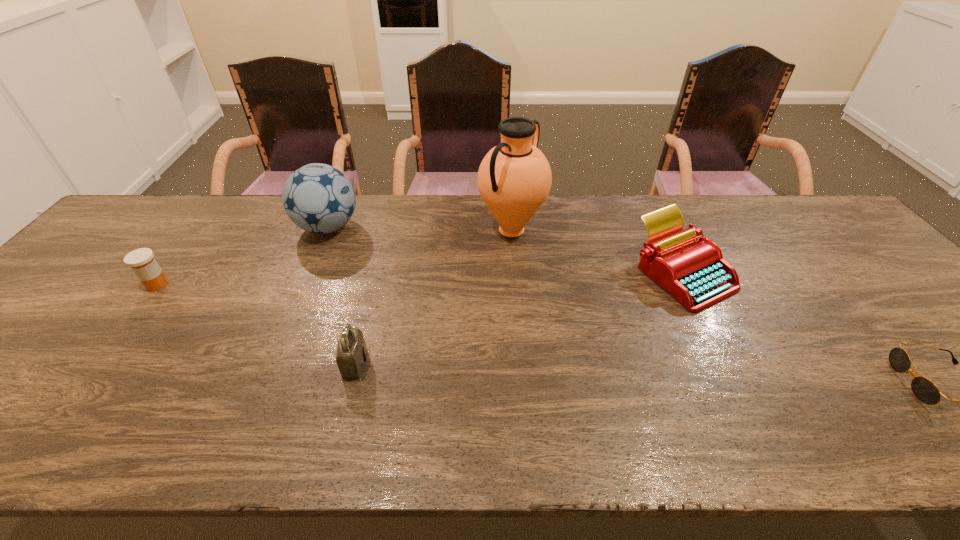
What are the coordinates of `vacant point located between the medicine and the third object from left to right` in the screenshot? It's located at coord(256,324).

Image resolution: width=960 pixels, height=540 pixels. Find the location of `empty space that is in between the second shortest object and the fifth object from right to left`. empty space that is in between the second shortest object and the fifth object from right to left is located at coordinates (243, 256).

Locate an element on the screen. vacant region between the tallest object and the fifth object from left to right is located at coordinates (597, 252).

The image size is (960, 540). In order to click on vacant area between the medicine and the padlock in this screenshot , I will do `click(256, 324)`.

Locate an element on the screen. free space between the third object from left to right and the second tallest object is located at coordinates click(342, 295).

At what (x,y) coordinates should I click in order to perform the action: click on object that ranks as the fifth closest to the rightmost object. Please return your answer as a coordinate pair (x, y). The height and width of the screenshot is (540, 960). Looking at the image, I should click on 142,262.

At what (x,y) coordinates should I click in order to perform the action: click on the closest object to the second object from left to right. Please return your answer as a coordinate pair (x, y). Looking at the image, I should click on (142, 262).

At what (x,y) coordinates should I click in order to perform the action: click on vacant area that satisfies the following two spatial constraints: 1. on the typing side of the typewriter; 2. on the label of the second shortest object. Please return your answer as a coordinate pair (x, y). Image resolution: width=960 pixels, height=540 pixels. Looking at the image, I should click on (687, 285).